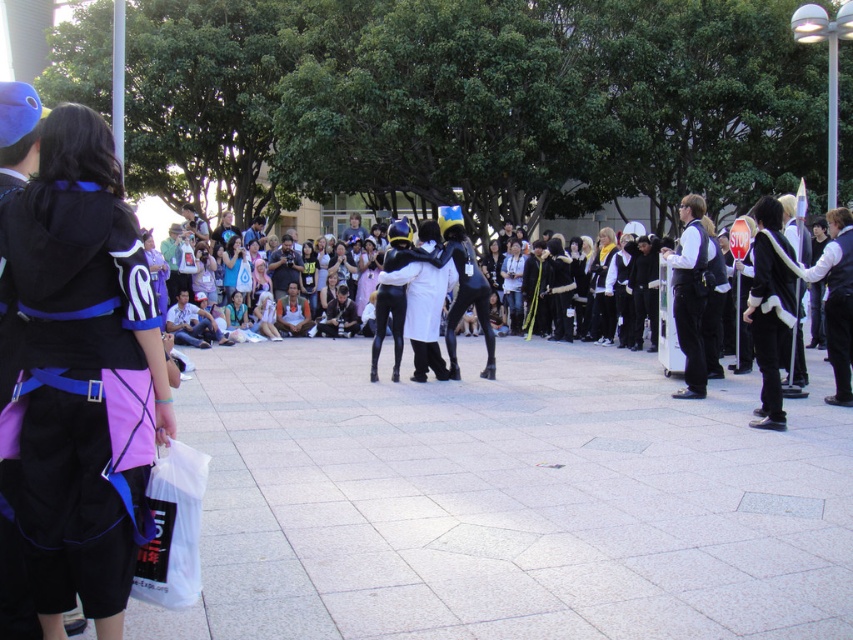
You are organizing a costume parade and need to arrange participants so that the wider item is on the left. Based on the scene, should the white fabric scarf at center be placed to the left or right of the light purple fabric dress at center?

The light purple fabric dress at center is wider than the white fabric scarf at center, so the light purple fabric dress at center should be placed on the left side to follow the requirement.

You are standing at the point with coordinates point (207, 248) and want to walk to the point with coordinates point (614, 248). Given that you can only move forward in a straight line, will you be able to reach your destination without changing direction?

Yes, because point (614, 248) is in front of point (207, 248), so moving forward in a straight line will allow you to reach it.

You are organizing a costume party and need to arrange the outfits based on their size. Which of the two items, the white matte vest at right or the denim jeans at center, should be placed in the smaller storage compartment?

The white matte vest at right should be placed in the smaller storage compartment because it occupies less space than the denim jeans at center.